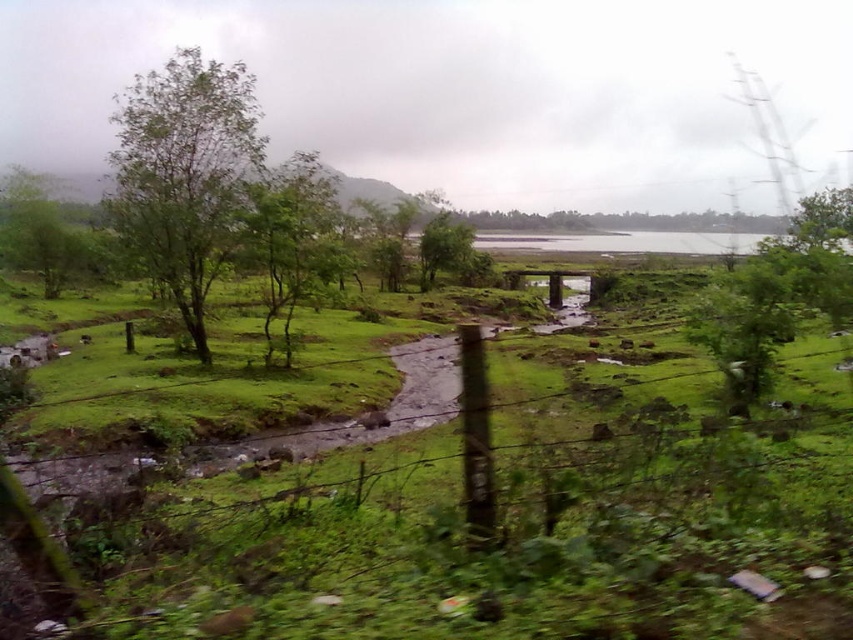
Question: Which of the following is the farthest from the observer?

Choices:
 (A) green leafy tree at center
 (B) green leafy tree at left

Answer: (A)

Question: Can you confirm if green leafy tree at left is smaller than green leafy tree at center?

Choices:
 (A) no
 (B) yes

Answer: (B)

Question: Does green leafy tree at left appear under green leafy tree at center?

Choices:
 (A) yes
 (B) no

Answer: (A)

Question: Where is green leafy tree at left located in relation to green leafy tree at center in the image?

Choices:
 (A) above
 (B) below

Answer: (B)